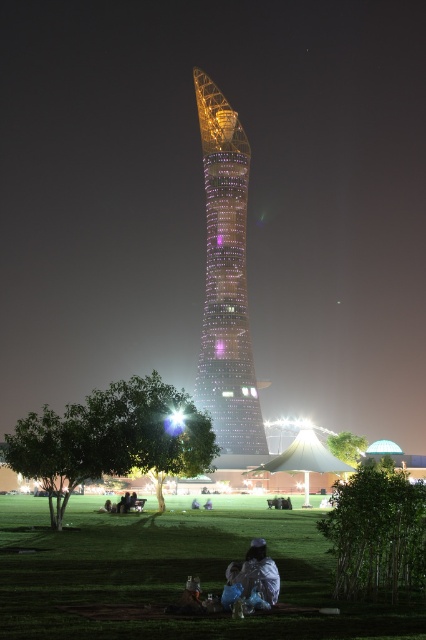
Can you confirm if green grass at lower center is positioned to the left of white fabric bag at lower center?

Indeed, green grass at lower center is positioned on the left side of white fabric bag at lower center.

How distant is green grass at lower center from white fabric bag at lower center?

green grass at lower center and white fabric bag at lower center are 16.30 meters apart.

Who is more forward, (x=92, y=513) or (x=229, y=584)?

Point (x=229, y=584) is in front.

Where is `green grass at lower center`? green grass at lower center is located at coordinates (172, 573).

Is green grass at lower center closer to camera compared to shiny glass tower at center?

Yes, green grass at lower center is closer to the viewer.

Which is behind, point (278, 550) or point (210, 148)?

The point (210, 148) is more distant.

Measure the distance between point (157, 627) and camera.

A distance of 386.94 feet exists between point (157, 627) and camera.

Locate an element on the screen. The height and width of the screenshot is (640, 426). green grass at lower center is located at coordinates click(172, 573).

Is shiny glass tower at center wider than white fabric bag at lower center?

Yes, shiny glass tower at center is wider than white fabric bag at lower center.

Does shiny glass tower at center have a smaller size compared to white fabric bag at lower center?

Incorrect, shiny glass tower at center is not smaller in size than white fabric bag at lower center.

Does point (226, 369) lie in front of point (255, 584)?

That is False.

Find the location of a particular element. Image resolution: width=426 pixels, height=640 pixels. shiny glass tower at center is located at coordinates (226, 280).